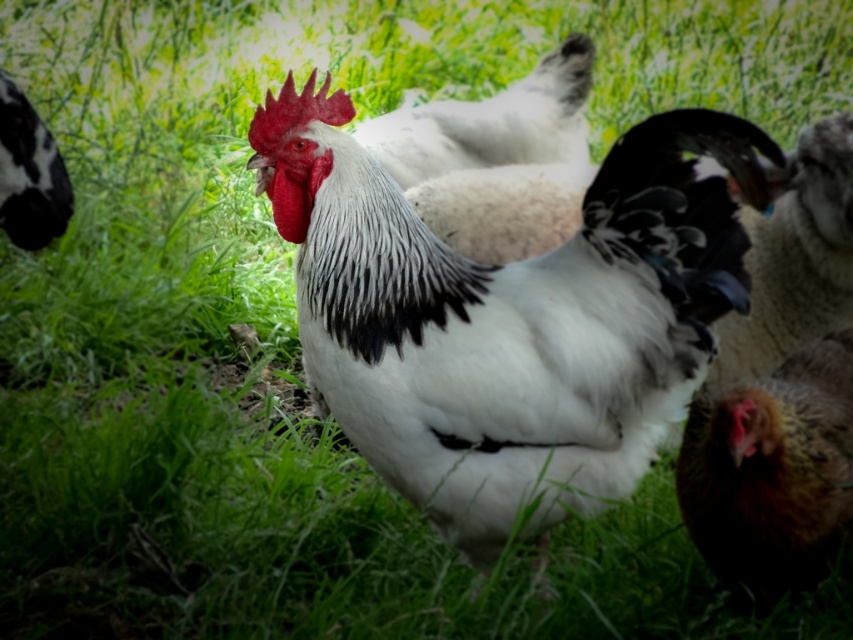
Question: Which point is farther to the camera?

Choices:
 (A) (560, 128)
 (B) (570, 502)

Answer: (A)

Question: Which point appears farthest from the camera in this image?

Choices:
 (A) (685, 236)
 (B) (833, 387)

Answer: (B)

Question: Does white fluffy rooster at center appear under brown speckled feather at lower right?

Choices:
 (A) no
 (B) yes

Answer: (A)

Question: Based on their relative distances, which object is farther from the white fluffy chicken at center?

Choices:
 (A) white fluffy rooster at center
 (B) brown speckled feather at lower right

Answer: (B)

Question: Does brown speckled feather at lower right have a smaller size compared to white fluffy chicken at center?

Choices:
 (A) no
 (B) yes

Answer: (B)

Question: Is white fluffy rooster at center smaller than brown speckled feather at lower right?

Choices:
 (A) no
 (B) yes

Answer: (A)